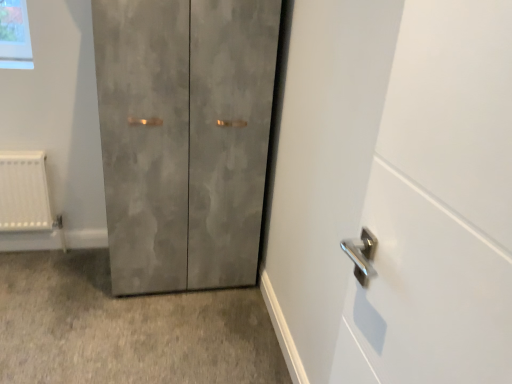
Question: Is point (245, 19) positioned closer to the camera than point (88, 340)?

Choices:
 (A) farther
 (B) closer

Answer: (B)

Question: In the image, is matte gray cabinet at center on the left side or the right side of concrete textured cabinet at lower left?

Choices:
 (A) left
 (B) right

Answer: (B)

Question: Based on their sizes in the image, would you say matte gray cabinet at center is bigger or smaller than concrete textured cabinet at lower left?

Choices:
 (A) big
 (B) small

Answer: (A)

Question: From a real-world perspective, relative to matte gray cabinet at center, is concrete textured cabinet at lower left vertically above or below?

Choices:
 (A) below
 (B) above

Answer: (A)

Question: In terms of size, does concrete textured cabinet at lower left appear bigger or smaller than matte gray cabinet at center?

Choices:
 (A) small
 (B) big

Answer: (A)

Question: From the image's perspective, is concrete textured cabinet at lower left positioned above or below matte gray cabinet at center?

Choices:
 (A) above
 (B) below

Answer: (B)

Question: Is concrete textured cabinet at lower left taller or shorter than matte gray cabinet at center?

Choices:
 (A) short
 (B) tall

Answer: (A)